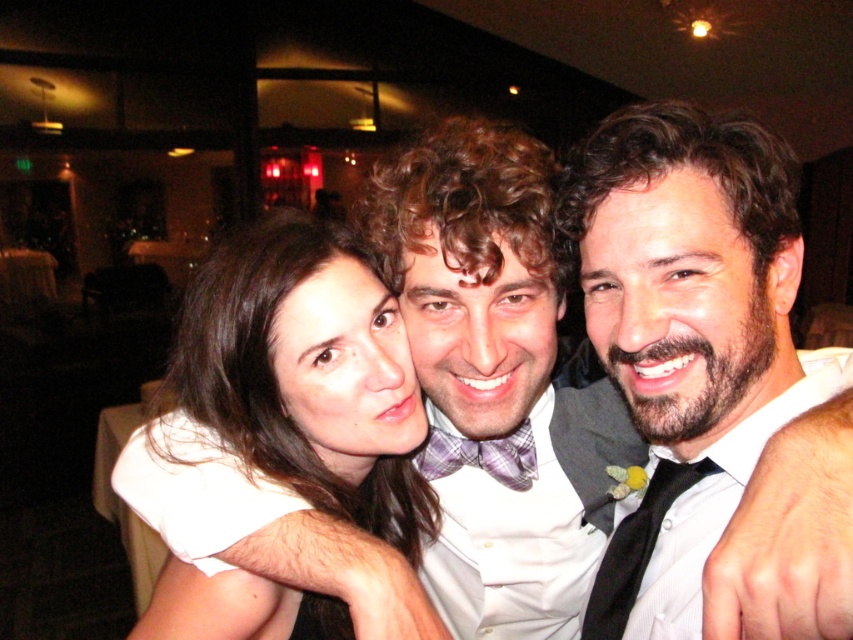
In the scene shown: You are at a formal event and notice two accessories on the individuals in the center of the image. Which one is positioned to the left when looking at the white satin bow tie at center and the black satin tie at center?

The white satin bow tie at center is positioned to the left of the black satin tie at center.

You are a photographer adjusting lighting for a portrait of the three people in the scene. You need to ensure that the smooth white blouse at center and the black satin tie at center are both clearly visible. Given their sizes, which one might require more careful lighting to avoid being overshadowed?

The black satin tie at center is smaller than the smooth white blouse at center, so it might require more careful lighting to ensure it is clearly visible and not overshadowed by the larger blouse.

You are a photographer at a formal event and need to adjust the lighting to focus on the smooth white blouse at center. Where should you direct the spotlight?

The smooth white blouse at center is located at point 0.586 on the x axis and 0.360 on the y axis, so direct the spotlight to those coordinates to focus on it.